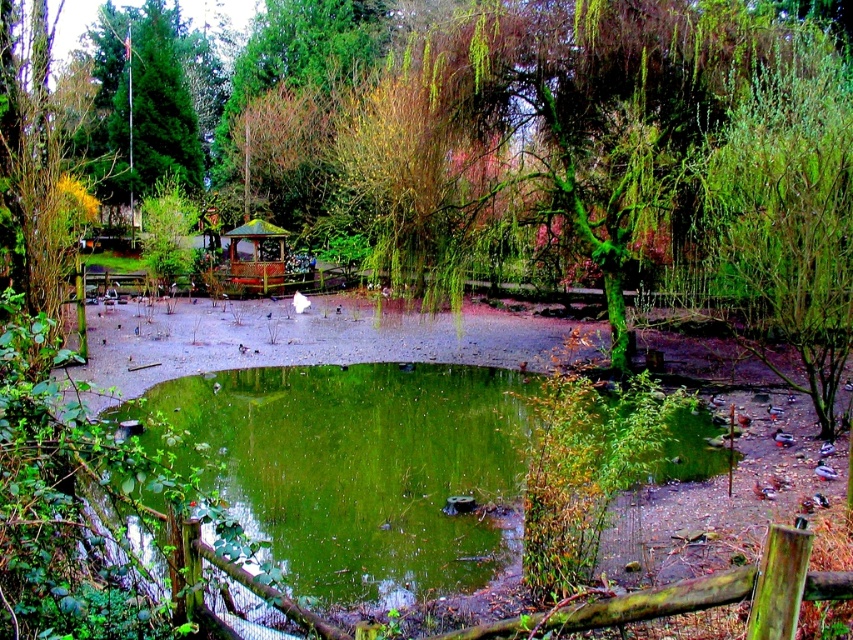
Question: From the image, what is the correct spatial relationship of green leafy tree at center in relation to wooden gazebo at center?

Choices:
 (A) right
 (B) left

Answer: (B)

Question: Which point is farther from the camera taking this photo?

Choices:
 (A) (0, 173)
 (B) (454, 580)

Answer: (B)

Question: Is green algae-covered pond at center to the right of wooden gazebo at center from the viewer's perspective?

Choices:
 (A) yes
 (B) no

Answer: (A)

Question: Does green leafy tree at center have a lesser width compared to wooden gazebo at center?

Choices:
 (A) yes
 (B) no

Answer: (B)

Question: Estimate the real-world distances between objects in this image. Which object is farther from the green leafy tree at center?

Choices:
 (A) green algae-covered pond at center
 (B) wooden gazebo at center

Answer: (B)

Question: Among these points, which one is farthest from the camera?

Choices:
 (A) (465, 563)
 (B) (267, 253)
 (C) (38, 198)

Answer: (B)